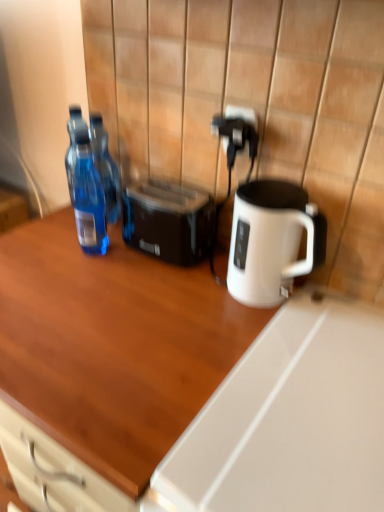
Locate an element on the screen. The width and height of the screenshot is (384, 512). vacant space positioned to the left of transparent plastic bottle at left, the second bottle in the front-to-back sequence is located at coordinates (48, 226).